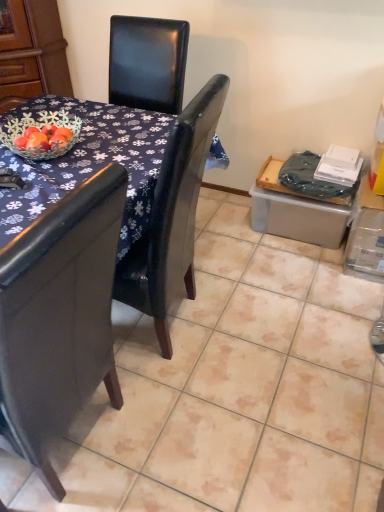
Question: From a real-world perspective, is black leather chair at upper center positioned over glossy dark wood table at center based on gravity?

Choices:
 (A) no
 (B) yes

Answer: (B)

Question: Is black leather chair at upper center smaller than glossy dark wood table at center?

Choices:
 (A) no
 (B) yes

Answer: (B)

Question: Is black leather chair at upper center to the left of glossy dark wood table at center from the viewer's perspective?

Choices:
 (A) no
 (B) yes

Answer: (A)

Question: From a real-world perspective, does black leather chair at upper center sit lower than glossy dark wood table at center?

Choices:
 (A) yes
 (B) no

Answer: (B)

Question: From the image's perspective, would you say black leather chair at upper center is shown under glossy dark wood table at center?

Choices:
 (A) no
 (B) yes

Answer: (A)

Question: Would you consider black leather chair at upper center to be distant from glossy dark wood table at center?

Choices:
 (A) yes
 (B) no

Answer: (B)

Question: Is glossy dark wood table at center positioned behind black leather chair at upper center?

Choices:
 (A) no
 (B) yes

Answer: (A)

Question: Can you confirm if glossy dark wood table at center is bigger than black leather chair at upper center?

Choices:
 (A) no
 (B) yes

Answer: (B)

Question: Is glossy dark wood table at center positioned before black leather chair at upper center?

Choices:
 (A) no
 (B) yes

Answer: (B)

Question: Can you confirm if glossy dark wood table at center is positioned to the left of black leather chair at upper center?

Choices:
 (A) no
 (B) yes

Answer: (B)

Question: Is glossy dark wood table at center next to black leather chair at upper center and touching it?

Choices:
 (A) no
 (B) yes

Answer: (B)

Question: Is black leather chair at upper center surrounded by glossy dark wood table at center?

Choices:
 (A) yes
 (B) no

Answer: (A)

Question: Is brushed wood armoire at upper left at the right side of black leather chair at upper center?

Choices:
 (A) no
 (B) yes

Answer: (A)